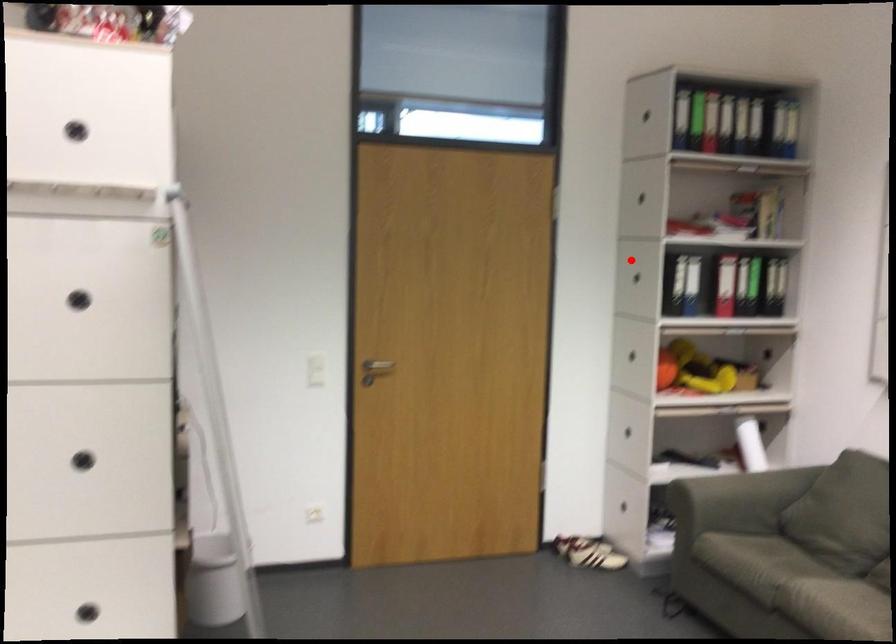
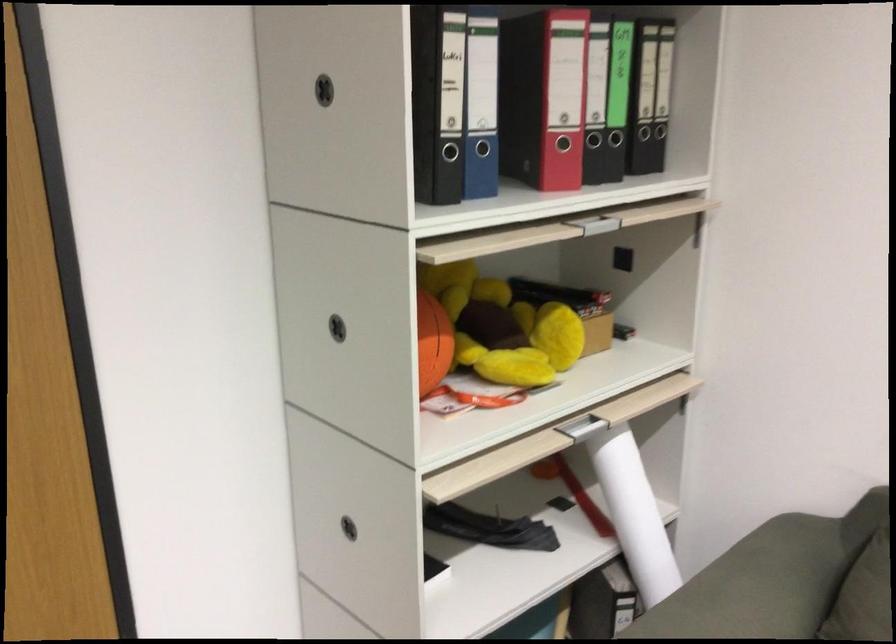
Question: I am providing you with two images of the same scene from different viewpoints. Given a red point in image1, look at the same physical point in image2. Is it:

Choices:
 (A) Closer to the viewpoint
 (B) Farther from the viewpoint

Answer: (A)